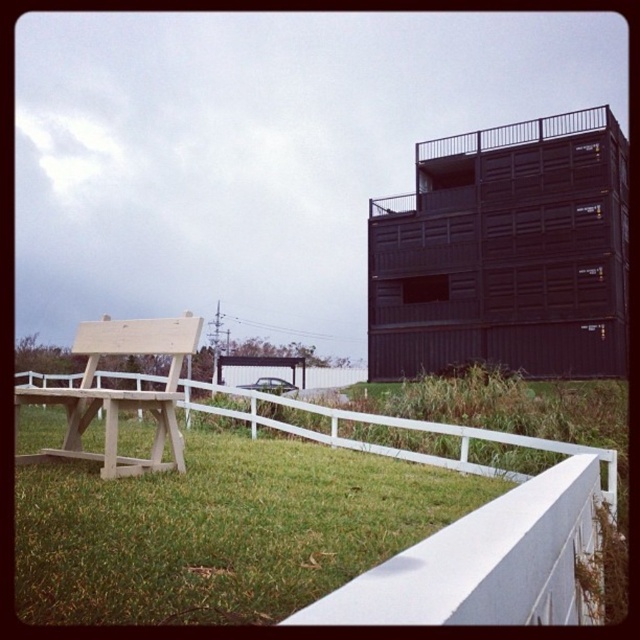
Question: Which of these objects is positioned closest to the light wood park bench at left?

Choices:
 (A) green grass at lower left
 (B) white wooden fence at lower center

Answer: (A)

Question: Does white wooden fence at lower center have a smaller size compared to light wood park bench at left?

Choices:
 (A) no
 (B) yes

Answer: (A)

Question: Which object is the farthest from the light wood park bench at left?

Choices:
 (A) green grass at lower left
 (B) white wooden fence at lower center

Answer: (B)

Question: From the image, what is the correct spatial relationship of green grass at lower left in relation to light wood park bench at left?

Choices:
 (A) right
 (B) left

Answer: (A)

Question: Is white wooden fence at lower center below light wood park bench at left?

Choices:
 (A) no
 (B) yes

Answer: (B)

Question: Which of the following is the farthest from the observer?

Choices:
 (A) light wood park bench at left
 (B) green grass at lower left

Answer: (A)